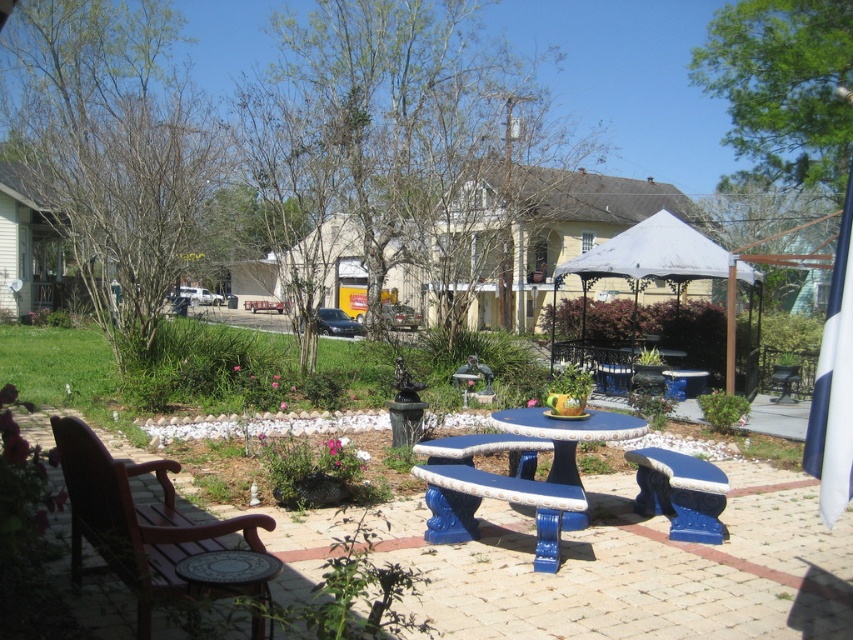
Question: Does brown wood chair at left appear over blue painted wood bench at center?

Choices:
 (A) no
 (B) yes

Answer: (B)

Question: Can you confirm if blue painted stone picnic table at center is thinner than blue ceramic bench at center?

Choices:
 (A) yes
 (B) no

Answer: (B)

Question: Which point is closer to the camera taking this photo?

Choices:
 (A) (537, 408)
 (B) (664, 234)

Answer: (A)

Question: Which point appears farthest from the camera in this image?

Choices:
 (A) (469, 512)
 (B) (166, 538)
 (C) (664, 468)

Answer: (C)

Question: Is white fabric gazebo at center thinner than blue glossy table at center?

Choices:
 (A) no
 (B) yes

Answer: (A)

Question: Which point is closer to the camera?

Choices:
 (A) (643, 490)
 (B) (161, 490)
 (C) (686, 236)
 (D) (468, 500)

Answer: (D)